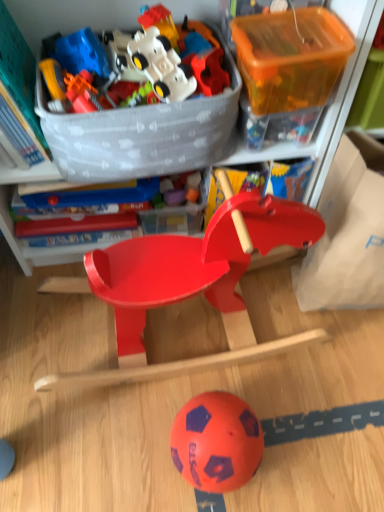
Question: In terms of height, does matte plastic toy car at upper center, which ranks as the second toy in top-to-bottom order, look taller or shorter compared to translucent orange plastic storage box at upper right, which ranks as the 2th storage box in right-to-left order?

Choices:
 (A) short
 (B) tall

Answer: (A)

Question: Is point (193, 31) positioned closer to the camera than point (271, 101)?

Choices:
 (A) closer
 (B) farther

Answer: (B)

Question: Estimate the real-world distances between objects in this image. Which object is closer to the translucent plastic storage box at upper center, which appears as the third storage box when viewed from the right?

Choices:
 (A) matte plastic storage box at right, arranged as the first storage box when viewed from the right
 (B) matte plastic toy car at upper center, which is the fifth toy in bottom-to-top order
 (C) translucent orange plastic storage box at upper right, which appears as the 2th storage box when viewed from the left
 (D) translucent plastic toy at upper left, which appears as the second toy when ordered from the bottom
 (E) matte plastic rocking horse at center

Answer: (E)

Question: Considering the real-world distances, which object is farthest from the white plastic toy car at upper center, the 4th toy when ordered from bottom to top?

Choices:
 (A) translucent orange plastic storage box at upper right, which ranks as the 2th storage box in right-to-left order
 (B) matte plastic rocking horse at center
 (C) white matte plastic toy car at upper center, the 6th toy positioned from the bottom
 (D) orange rubber ball at lower center
 (E) rubberized plastic toy at upper center, the 4th toy viewed from the top

Answer: (D)